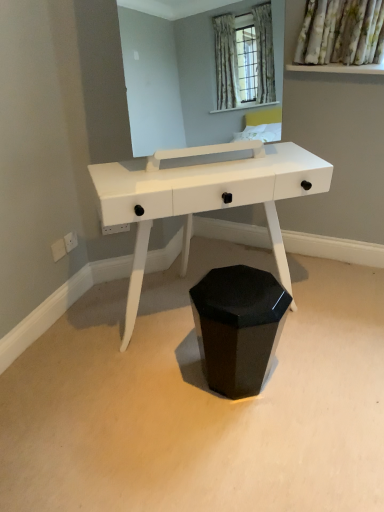
This screenshot has width=384, height=512. I want to click on vacant point to the right of black glossy hexagonal waste bin at center, so click(x=308, y=380).